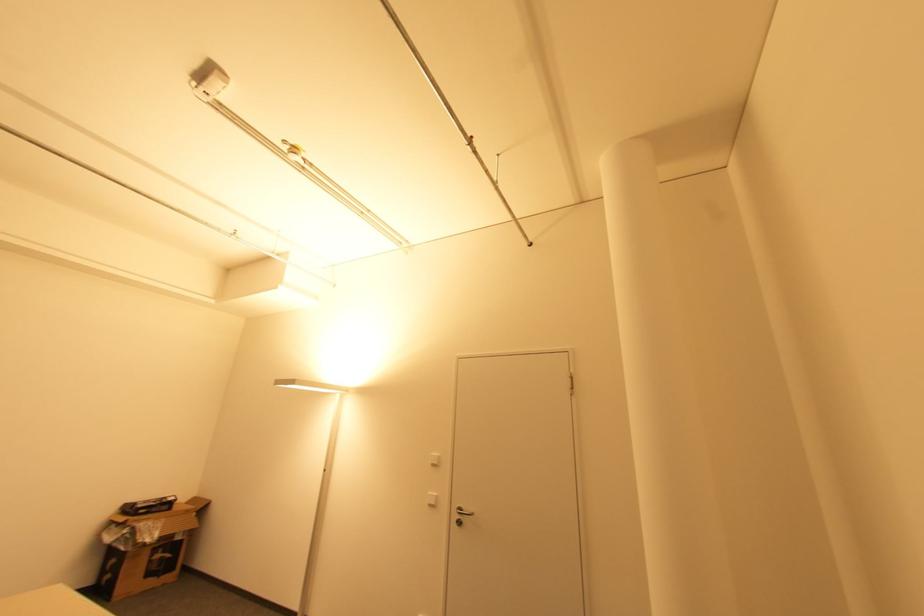
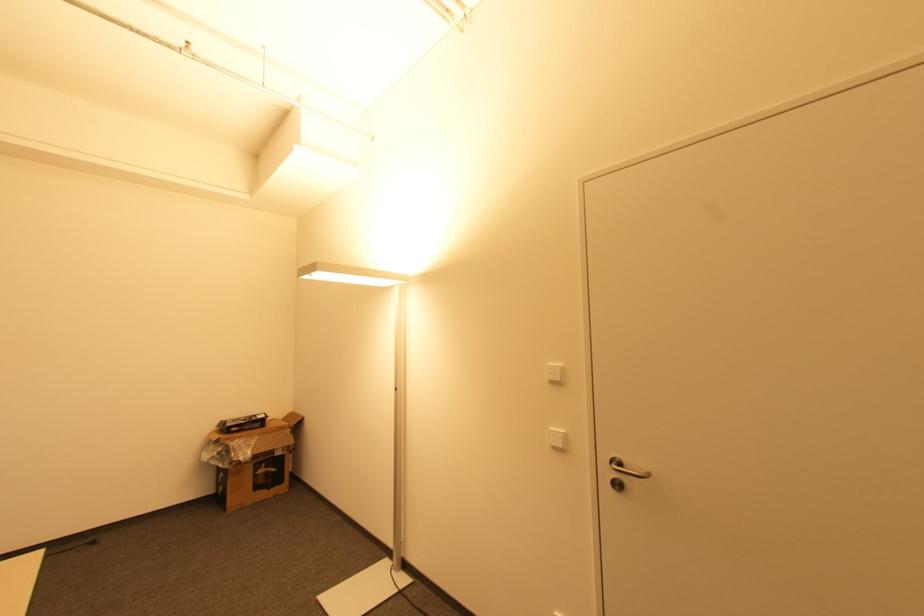
In the second image, find the point that corresponds to point 164,559 in the first image.

(268, 472)